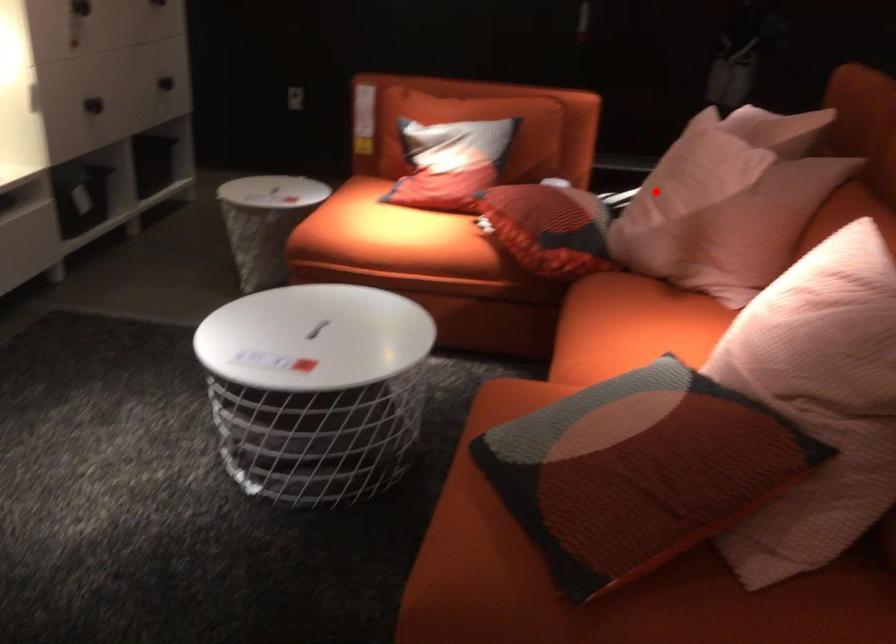
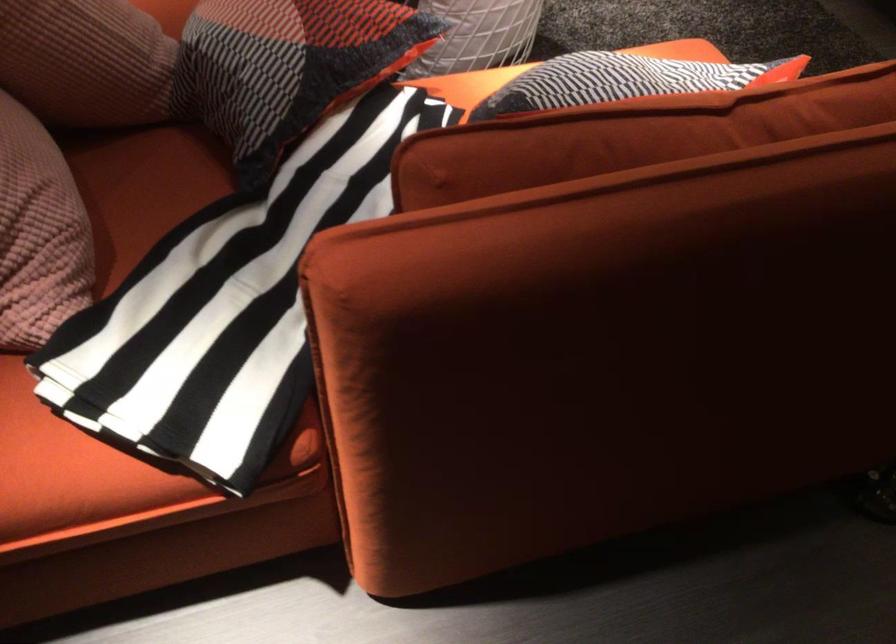
Where in the second image is the point corresponding to the highlighted location from the first image?

(85, 61)